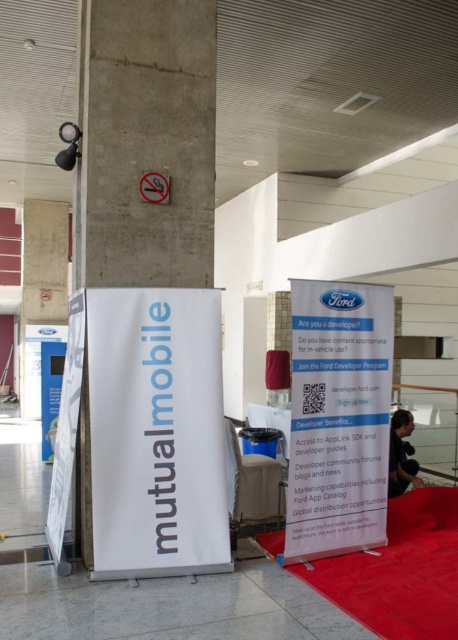
Which is behind, point (135, 60) or point (306, 442)?

Positioned behind is point (135, 60).

Is point (201, 161) less distant than point (359, 410)?

No, (201, 161) is behind (359, 410).

In order to click on white matte pillar at left in this screenshot , I will do `click(146, 141)`.

Does white paper signboard at center have a smaller size compared to white paperboard at center?

Indeed, white paper signboard at center has a smaller size compared to white paperboard at center.

Between white paper signboard at center and white paperboard at center, which one appears on the left side from the viewer's perspective?

Positioned to the left is white paper signboard at center.

The height and width of the screenshot is (640, 458). What are the coordinates of `white paper signboard at center` in the screenshot? It's located at (156, 433).

Consider the image. Is white matte pillar at left thinner than white paper signboard at center?

Yes, white matte pillar at left is thinner than white paper signboard at center.

In the scene shown: Is white matte pillar at left positioned in front of white paper signboard at center?

No, white matte pillar at left is behind white paper signboard at center.

Does point (107, 275) come closer to viewer compared to point (181, 339)?

No, (107, 275) is further to viewer.

Where is `white matte pillar at left`? The image size is (458, 640). white matte pillar at left is located at coordinates (146, 141).